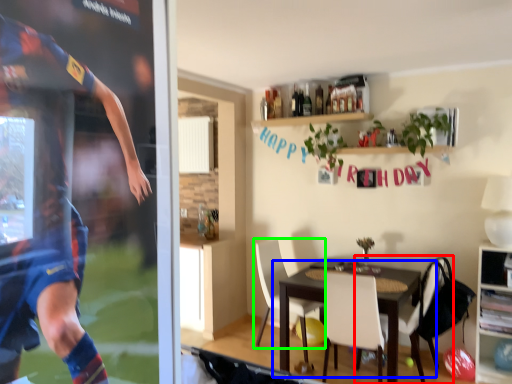
Question: Considering the real-world distances, which object is farthest from chair (highlighted by a red box)? table (highlighted by a blue box) or chair (highlighted by a green box)?

Choices:
 (A) table
 (B) chair

Answer: (B)